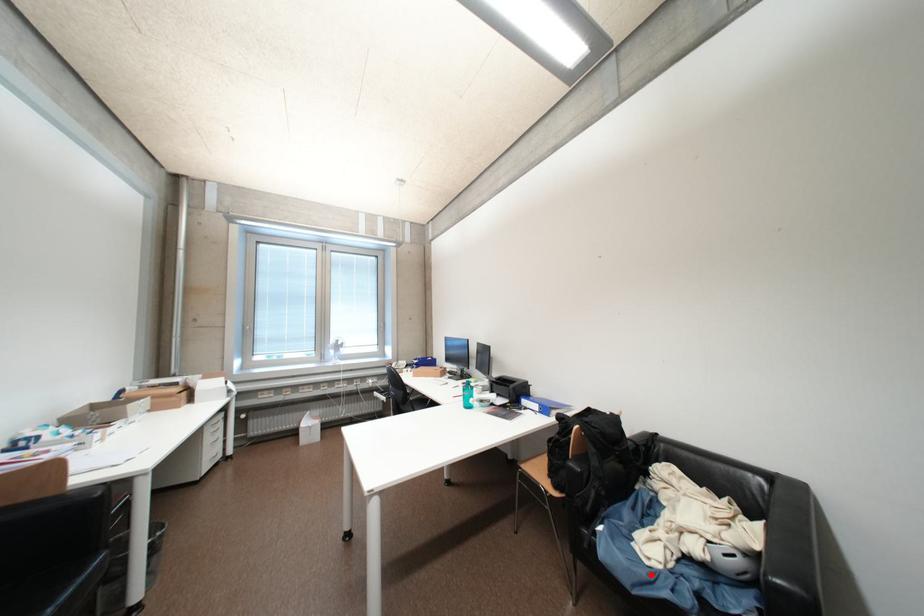
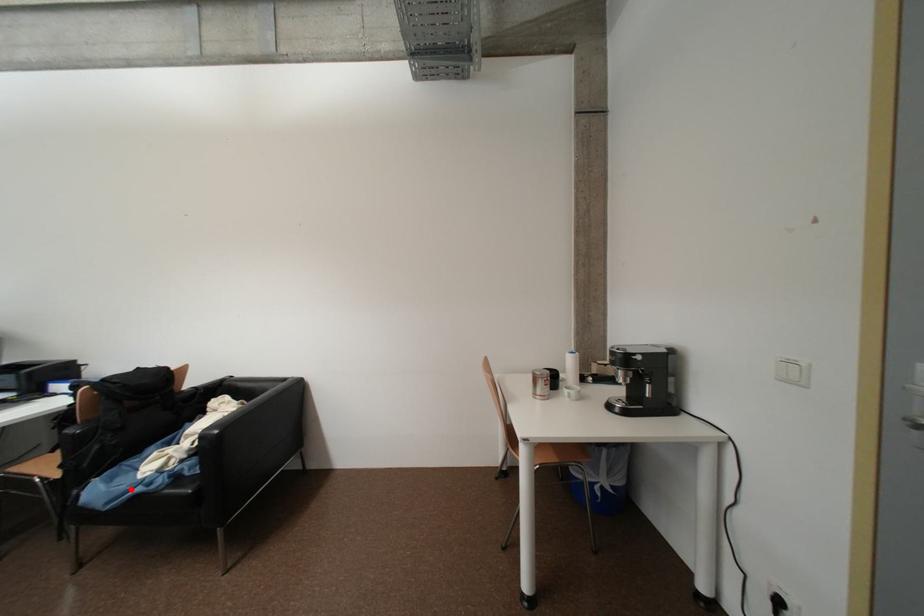
I am providing you with two images of the same scene from different viewpoints. A red point is marked on the first image and another point is marked on the second image. Does the point marked in image1 correspond to the same location as the one in image2?

Yes